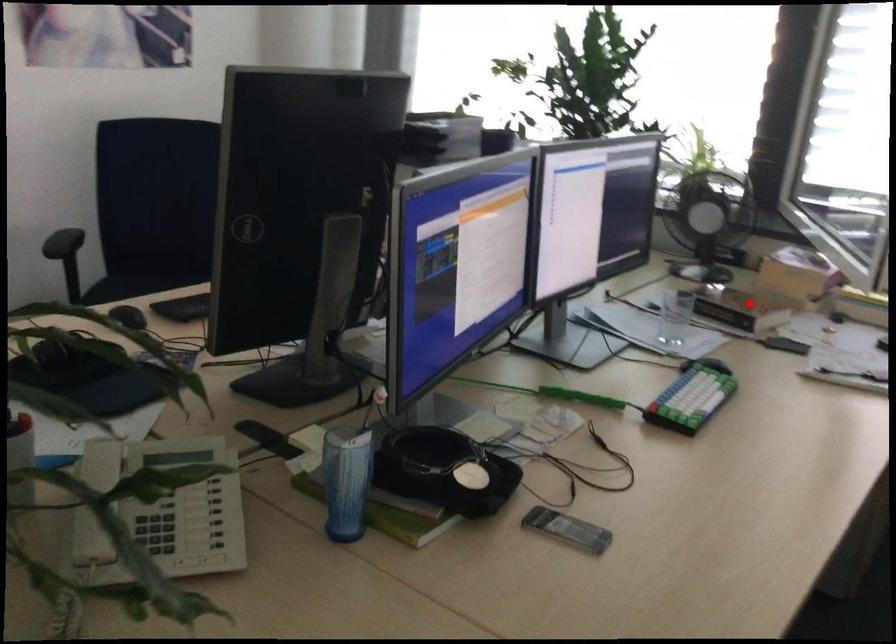
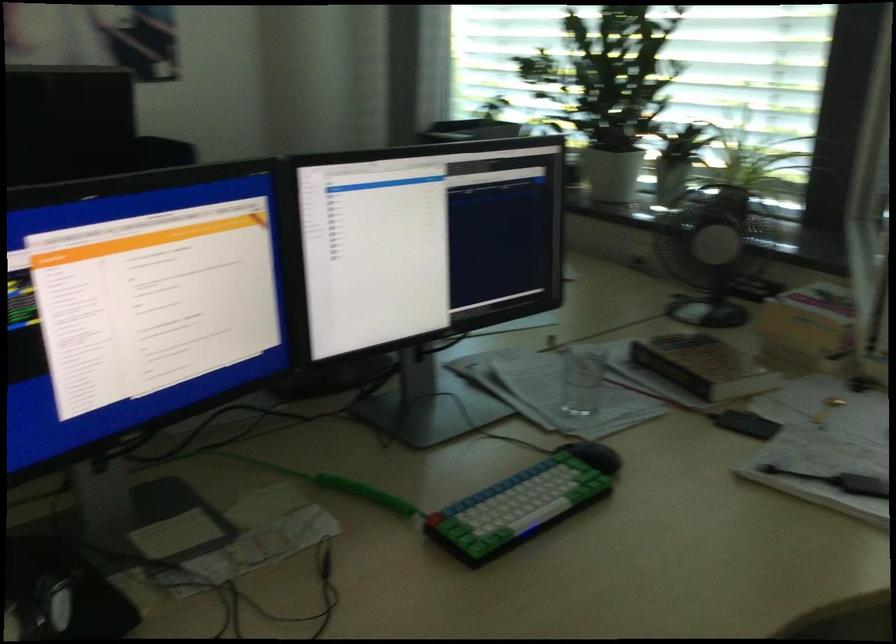
Question: I am providing you with two images of the same scene from different viewpoints. In image1, a red point is highlighted. Considering the same 3D point in image2, which of the following is correct?

Choices:
 (A) It is closer
 (B) It is farther

Answer: (A)